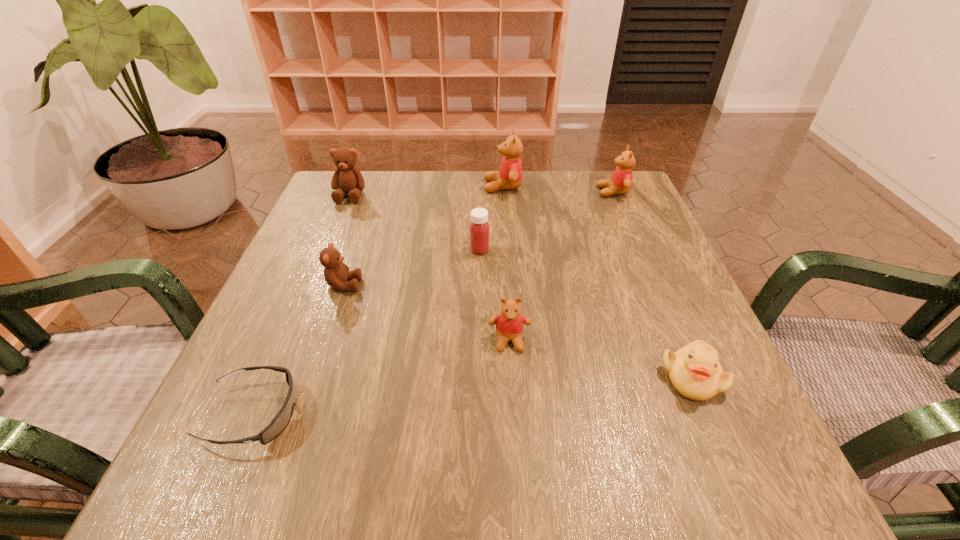
Find the location of `object present at the near left corner`. object present at the near left corner is located at coordinates (x=281, y=420).

Image resolution: width=960 pixels, height=540 pixels. I want to click on object that is at the far right corner, so click(x=621, y=180).

This screenshot has width=960, height=540. In the image, there is a desktop. Find the location of `free space at the far edge`. free space at the far edge is located at coordinates (391, 183).

Find the location of a particular element. The image size is (960, 540). blank space at the near edge of the desktop is located at coordinates (591, 442).

Locate an element on the screen. The width and height of the screenshot is (960, 540). vacant space at the left edge of the desktop is located at coordinates (241, 352).

In order to click on blank space at the right edge in this screenshot , I will do `click(653, 381)`.

Find the location of a particular element. free spot at the near left corner of the desktop is located at coordinates (226, 451).

Locate an element on the screen. blank area at the near right corner is located at coordinates (732, 471).

Find the location of a particular element. free space between the red medicine and the smaller brown teddy bear is located at coordinates (412, 267).

Where is `vacant area that lies between the rightmost red teddy bear and the farther brown teddy bear`? vacant area that lies between the rightmost red teddy bear and the farther brown teddy bear is located at coordinates (482, 193).